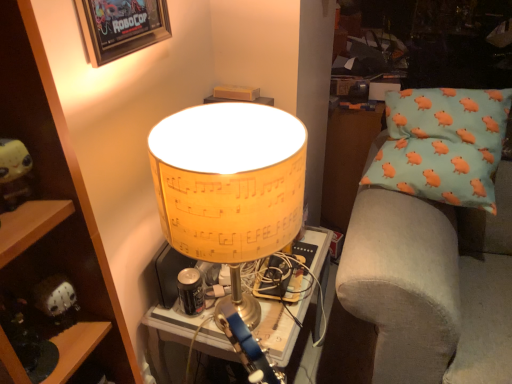
The width and height of the screenshot is (512, 384). In order to click on light blue fabric pillow with orange pig patterns at right in this screenshot , I will do `click(443, 145)`.

Measure the distance between point (423, 166) and camera.

Point (423, 166) is 4.14 feet from camera.

In order to face light blue fabric pillow with orange pig patterns at right, should I rotate leftwards or rightwards?

Rotate your view right by about 25.614°.

Measure the distance between yellow paper lampshade at center and camera.

A distance of 26.71 inches exists between yellow paper lampshade at center and camera.

The height and width of the screenshot is (384, 512). Identify the location of yellow paper lampshade at center. (170, 332).

Considering the relative sizes of yellow plush toy at left and wooden framed poster at upper left in the image provided, is yellow plush toy at left taller than wooden framed poster at upper left?

Incorrect, the height of yellow plush toy at left is not larger of that of wooden framed poster at upper left.

Where is `toy lying in front of the wooden framed poster at upper left`? toy lying in front of the wooden framed poster at upper left is located at coordinates (14, 174).

Does yellow plush toy at left turn towards wooden framed poster at upper left?

No.

Looking at this image, considering the sizes of yellow plush toy at left and wooden framed poster at upper left in the image, is yellow plush toy at left wider or thinner than wooden framed poster at upper left?

In the image, yellow plush toy at left appears to be wider than wooden framed poster at upper left.

Which object is positioned more to the left, light blue fabric pillow with orange pig patterns at right or yellow paper lampshade at center?

From the viewer's perspective, yellow paper lampshade at center appears more on the left side.

Considering their positions, is light blue fabric pillow with orange pig patterns at right located in front of or behind yellow paper lampshade at center?

In the image, light blue fabric pillow with orange pig patterns at right appears behind yellow paper lampshade at center.

Is light blue fabric pillow with orange pig patterns at right oriented away from yellow paper lampshade at center?

No, light blue fabric pillow with orange pig patterns at right is not facing away from yellow paper lampshade at center.

Considering the relative sizes of light blue fabric pillow with orange pig patterns at right and yellow paper lampshade at center in the image provided, is light blue fabric pillow with orange pig patterns at right taller than yellow paper lampshade at center?

Yes, light blue fabric pillow with orange pig patterns at right is taller than yellow paper lampshade at center.

Is yellow plush toy at left in front of or behind yellow paper lampshade at center in the image?

In the image, yellow plush toy at left appears in front of yellow paper lampshade at center.

Locate an element on the screen. This screenshot has width=512, height=384. lamp that is under the yellow plush toy at left (from a real-world perspective) is located at coordinates (230, 186).

Considering the sizes of objects yellow plush toy at left and yellow paper lampshade at center in the image provided, who is thinner, yellow plush toy at left or yellow paper lampshade at center?

Thinner between the two is yellow plush toy at left.

Is yellow plush toy at left surrounding yellow paper lampshade at center?

No, yellow paper lampshade at center is not a part of yellow plush toy at left.

From the image's perspective, relative to wooden shelf at left, is yellow paper lampshade at center above or below?

From the image's perspective, yellow paper lampshade at center appears below wooden shelf at left.

Can we say yellow paper lampshade at center lies outside wooden shelf at left?

Yes, yellow paper lampshade at center is located beyond the bounds of wooden shelf at left.

Does yellow paper lampshade at center appear on the right side of wooden shelf at left?

Yes.

Which is in front, point (165, 332) or point (388, 100)?

The point (165, 332) is closer.

Between yellow paper lampshade at center and light blue fabric pillow with orange pig patterns at right, which one has more height?

Standing taller between the two is light blue fabric pillow with orange pig patterns at right.

Who is bigger, yellow paper lampshade at center or light blue fabric pillow with orange pig patterns at right?

light blue fabric pillow with orange pig patterns at right.

From the image's perspective, is yellow plush toy at left located above or below wooden shelf at left?

Clearly, from the image's perspective, yellow plush toy at left is above wooden shelf at left.

Considering the relative sizes of yellow plush toy at left and wooden shelf at left in the image provided, is yellow plush toy at left taller than wooden shelf at left?

No, yellow plush toy at left is not taller than wooden shelf at left.

In the scene shown: Is yellow plush toy at left aimed at wooden shelf at left?

Yes, yellow plush toy at left is aimed at wooden shelf at left.

From a real-world perspective, which is physically above, yellow plush toy at left or wooden shelf at left?

yellow plush toy at left, from a real-world perspective.

Is light blue fabric pillow with orange pig patterns at right further to camera compared to yellow paper lampshade at center?

Yes, light blue fabric pillow with orange pig patterns at right is further from the camera.

From the image's perspective, is light blue fabric pillow with orange pig patterns at right positioned above or below yellow paper lampshade at center?

From the image's perspective, light blue fabric pillow with orange pig patterns at right appears above yellow paper lampshade at center.

Is light blue fabric pillow with orange pig patterns at right wider or thinner than yellow paper lampshade at center?

light blue fabric pillow with orange pig patterns at right is wider than yellow paper lampshade at center.

Which point is more distant from viewer, [423,114] or [175,354]?

The point [175,354] is farther from the camera.

Image resolution: width=512 pixels, height=384 pixels. Identify the location of picture frame above the yellow plush toy at left (from the image's perspective). point(121,27).

Locate an element on the screen. The image size is (512, 384). furniture lying behind the yellow paper lampshade at center is located at coordinates (419, 224).

Based on the photo, considering their positions, is yellow plush toy at left positioned closer to light blue fabric pillow with orange pig patterns at right than yellow paper lampshade at center?

yellow paper lampshade at center lies closer to light blue fabric pillow with orange pig patterns at right than the other object.

Based on their spatial positions, is wooden framed poster at upper left or light blue fabric pillow with orange pig patterns at right further from yellow paper lampshade at center?

wooden framed poster at upper left lies further to yellow paper lampshade at center than the other object.

Looking at the image, which one is located further to wooden shelf at left, yellow paper lampshade at center or wooden framed poster at upper left?

yellow paper lampshade at center lies further to wooden shelf at left than the other object.

Considering their positions, is wooden shelf at left positioned further to yellow paper lampshade at center than yellow paper lampshade at center?

yellow paper lampshade at center is positioned further to the anchor yellow paper lampshade at center.

Estimate the real-world distances between objects in this image. Which object is further from light blue fabric pillow with orange pig patterns at right, wooden shelf at left or yellow plush toy at left?

yellow plush toy at left is further to light blue fabric pillow with orange pig patterns at right.

From the image, which object appears to be farther from light blue fabric pillow with orange pig patterns at right, yellow plush toy at left or wooden framed poster at upper left?

yellow plush toy at left is further to light blue fabric pillow with orange pig patterns at right.

Based on the photo, when comparing their distances from light blue fabric pillow with orange pig patterns at right, does wooden shelf at left or wooden framed poster at upper left seem further?

wooden framed poster at upper left is further to light blue fabric pillow with orange pig patterns at right.

Looking at the image, which one is located further to yellow plush toy at left, yellow paper lampshade at center or light blue fabric pillow with orange pig patterns at right?

light blue fabric pillow with orange pig patterns at right is positioned further to the anchor yellow plush toy at left.

The height and width of the screenshot is (384, 512). In order to click on lamp between yellow plush toy at left and light blue fabric pillow with orange pig patterns at right in this screenshot , I will do `click(230, 186)`.

This screenshot has width=512, height=384. What are the coordinates of `table situated between wooden shelf at left and light blue fabric pillow with orange pig patterns at right from left to right` in the screenshot? It's located at (170, 332).

The width and height of the screenshot is (512, 384). I want to click on toy situated between wooden shelf at left and yellow paper lampshade at center from left to right, so click(14, 174).

The image size is (512, 384). Find the location of `table located between wooden shelf at left and light blue fabric pillow with orange pig patterns at right in the left-right direction`. table located between wooden shelf at left and light blue fabric pillow with orange pig patterns at right in the left-right direction is located at coordinates (170, 332).